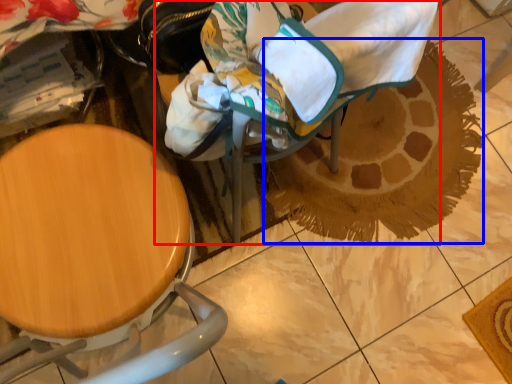
Question: Which object is closer to the camera taking this photo, baby carriage (highlighted by a red box) or doormat (highlighted by a blue box)?

Choices:
 (A) baby carriage
 (B) doormat

Answer: (A)